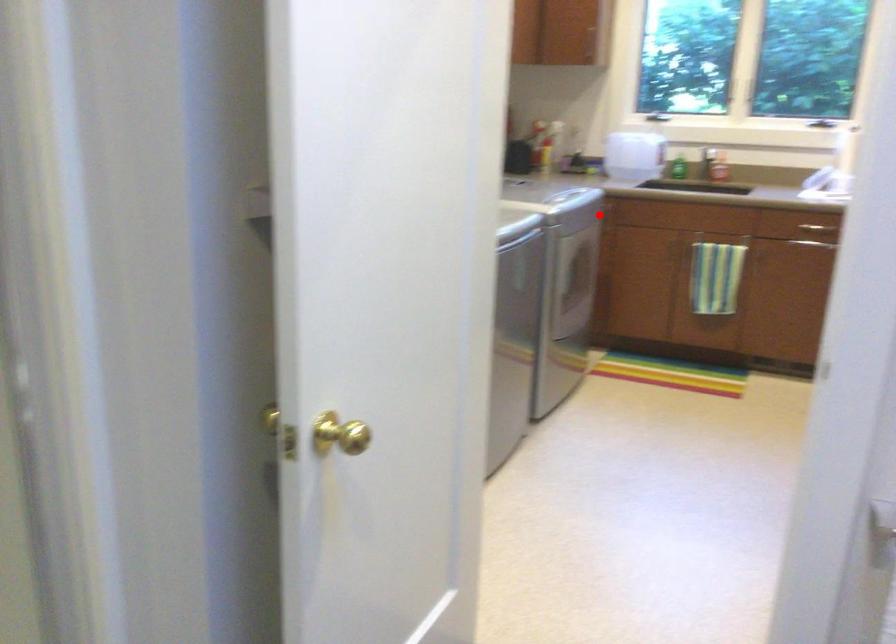
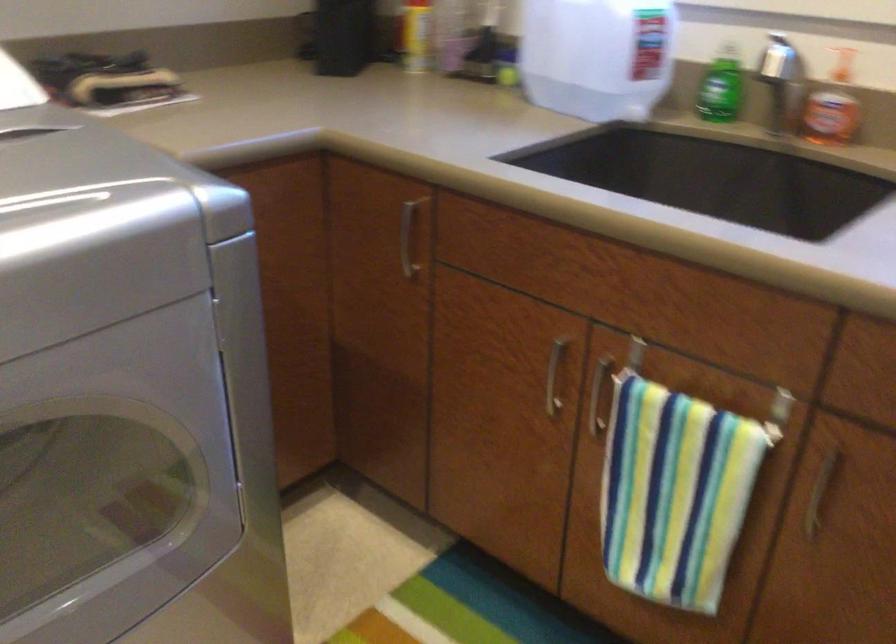
Question: I am providing you with two images of the same scene from different viewpoints. In image1, a red point is highlighted. Considering the same 3D point in image2, which of the following is correct?

Choices:
 (A) It is closer
 (B) It is farther

Answer: (A)